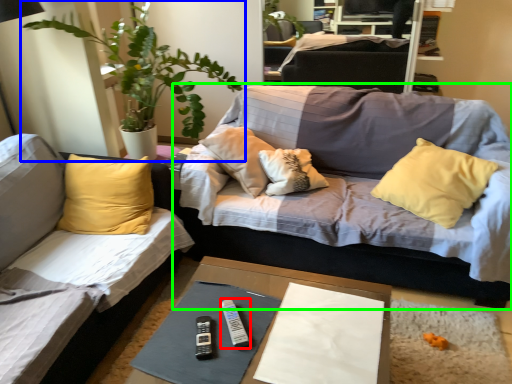
Question: Which object is the farthest from remote (highlighted by a red box)? Choose among these: houseplant (highlighted by a blue box) or studio couch (highlighted by a green box).

Choices:
 (A) houseplant
 (B) studio couch

Answer: (A)